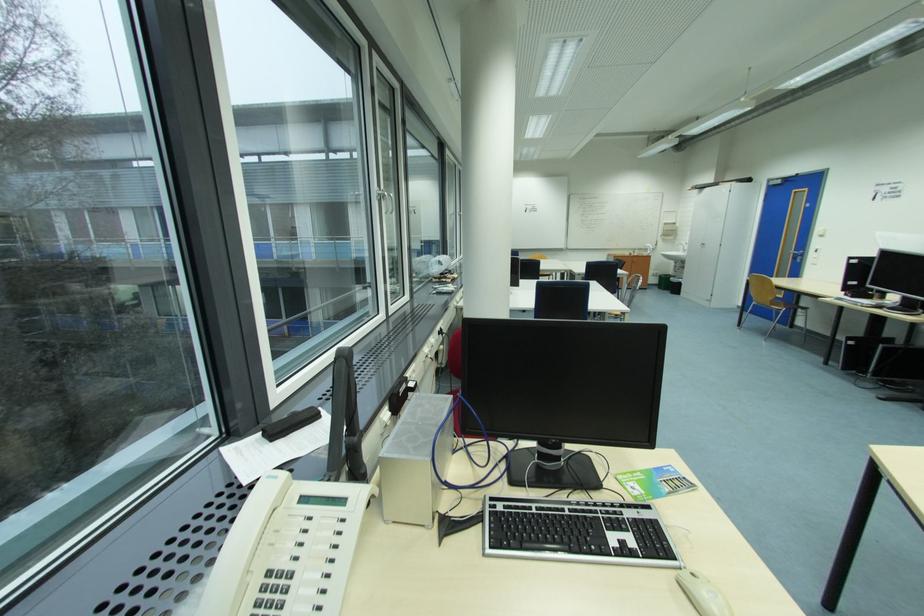
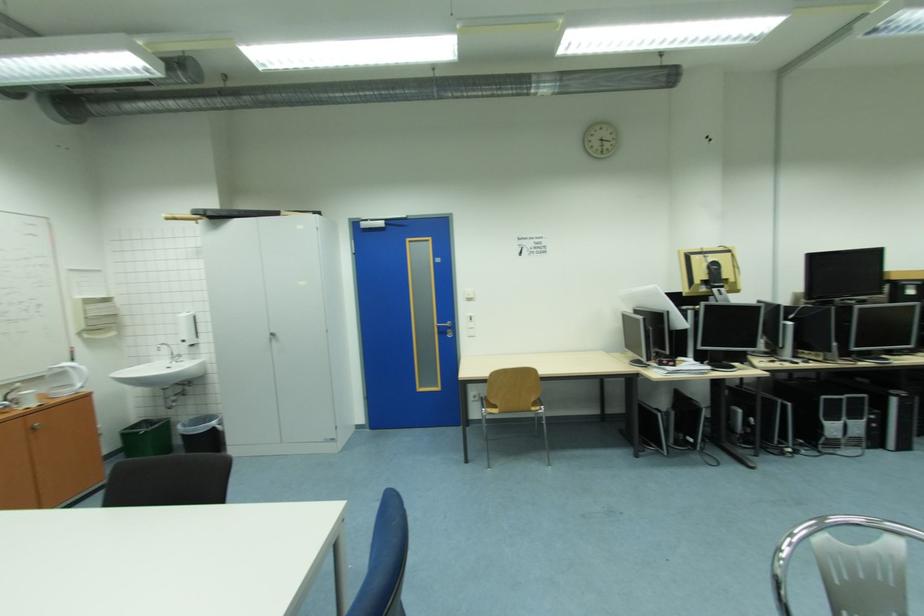
In the second image, find the point that corresponds to point 673,225 in the first image.

(94, 302)